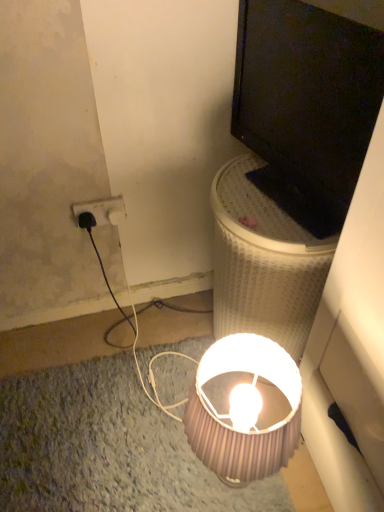
Question: From a real-world perspective, is pink ribbed lampshade at lower center on top of white mesh laundry basket at upper right?

Choices:
 (A) yes
 (B) no

Answer: (B)

Question: Is there a large distance between pink ribbed lampshade at lower center and white mesh laundry basket at upper right?

Choices:
 (A) yes
 (B) no

Answer: (B)

Question: Is pink ribbed lampshade at lower center outside of white mesh laundry basket at upper right?

Choices:
 (A) yes
 (B) no

Answer: (A)

Question: Is pink ribbed lampshade at lower center shorter than white mesh laundry basket at upper right?

Choices:
 (A) yes
 (B) no

Answer: (A)

Question: Is pink ribbed lampshade at lower center oriented towards white mesh laundry basket at upper right?

Choices:
 (A) no
 (B) yes

Answer: (A)

Question: From the image's perspective, is pink ribbed lampshade at lower center above or below black plastic power outlet at upper left?

Choices:
 (A) below
 (B) above

Answer: (A)

Question: Considering the relative positions of pink ribbed lampshade at lower center and black plastic power outlet at upper left in the image provided, is pink ribbed lampshade at lower center to the left or to the right of black plastic power outlet at upper left?

Choices:
 (A) left
 (B) right

Answer: (B)

Question: Looking at the image, does pink ribbed lampshade at lower center seem bigger or smaller compared to black plastic power outlet at upper left?

Choices:
 (A) small
 (B) big

Answer: (B)

Question: Is pink ribbed lampshade at lower center in front of or behind black plastic power outlet at upper left in the image?

Choices:
 (A) behind
 (B) front

Answer: (B)

Question: Is white mesh laundry basket at upper right in front of or behind black plastic power outlet at upper left in the image?

Choices:
 (A) behind
 (B) front

Answer: (B)

Question: From the image's perspective, relative to black plastic power outlet at upper left, is white mesh laundry basket at upper right above or below?

Choices:
 (A) below
 (B) above

Answer: (A)

Question: Based on their sizes in the image, would you say white mesh laundry basket at upper right is bigger or smaller than black plastic power outlet at upper left?

Choices:
 (A) big
 (B) small

Answer: (A)

Question: Considering the positions of point (233, 206) and point (72, 203), is point (233, 206) closer or farther from the camera than point (72, 203)?

Choices:
 (A) farther
 (B) closer

Answer: (B)

Question: In terms of width, does black glossy monitor at upper right look wider or thinner when compared to white mesh laundry basket at upper right?

Choices:
 (A) thin
 (B) wide

Answer: (A)

Question: Do you think black glossy monitor at upper right is within white mesh laundry basket at upper right, or outside of it?

Choices:
 (A) outside
 (B) inside

Answer: (A)